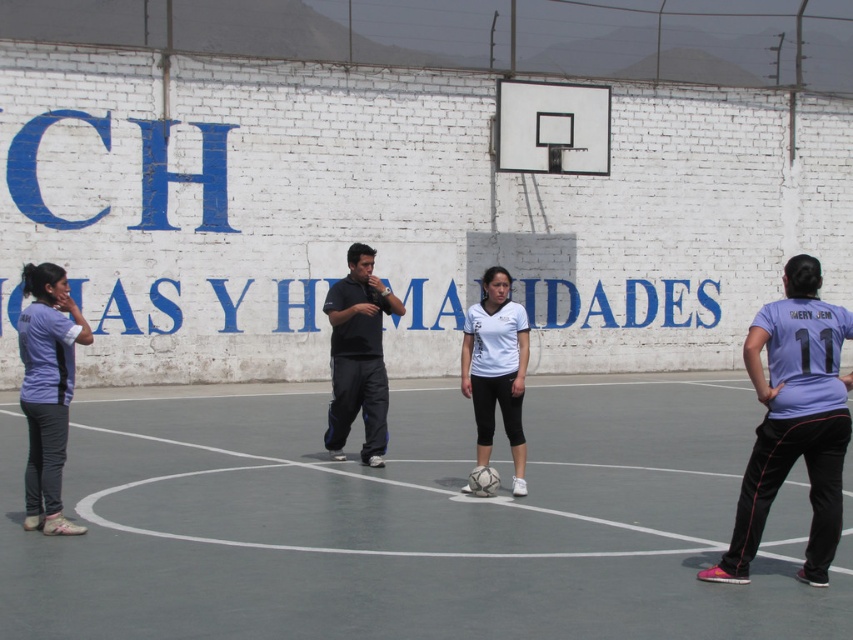
Question: Does purple matte shirt at right lie behind purple fabric shirt at left?

Choices:
 (A) no
 (B) yes

Answer: (A)

Question: Which object appears farthest from the camera in this image?

Choices:
 (A) purple matte shirt at right
 (B) purple fabric shirt at left
 (C) black matte shirt at center
 (D) white matte soccer ball at center

Answer: (C)

Question: Where is purple matte shirt at right located in relation to black matte shirt at center in the image?

Choices:
 (A) left
 (B) right

Answer: (B)

Question: Which is nearer to the white rubber court at center?

Choices:
 (A) purple matte shirt at right
 (B) black matte shirt at center

Answer: (B)

Question: Which is farther from the white rubber court at center?

Choices:
 (A) purple matte shirt at right
 (B) purple fabric shirt at left

Answer: (B)

Question: Can you confirm if white rubber court at center is smaller than black matte shirt at center?

Choices:
 (A) yes
 (B) no

Answer: (B)